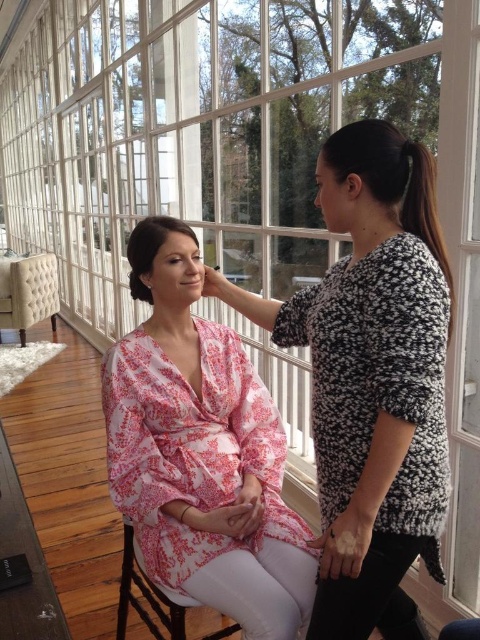
Question: Is pink floral dress at center to the left of black textured hair at right from the viewer's perspective?

Choices:
 (A) no
 (B) yes

Answer: (B)

Question: Is pink floral dress at center closer to camera compared to wooden chair at lower center?

Choices:
 (A) yes
 (B) no

Answer: (A)

Question: Which point is closer to the camera?

Choices:
 (A) (237, 624)
 (B) (241, 388)
 (C) (175, 220)

Answer: (C)

Question: Is fluffy black sweater at upper right wider than pink floral dress at center?

Choices:
 (A) yes
 (B) no

Answer: (A)

Question: Which object is positioned farthest from the fluffy black sweater at upper right?

Choices:
 (A) wooden chair at lower center
 (B) pink floral dress at center

Answer: (A)

Question: Estimate the real-world distances between objects in this image. Which object is farther from the dark brown silky hair at center?

Choices:
 (A) tufted beige chair at left
 (B) fluffy black sweater at upper right
 (C) wooden chair at lower center
 (D) pink floral dress at center

Answer: (A)